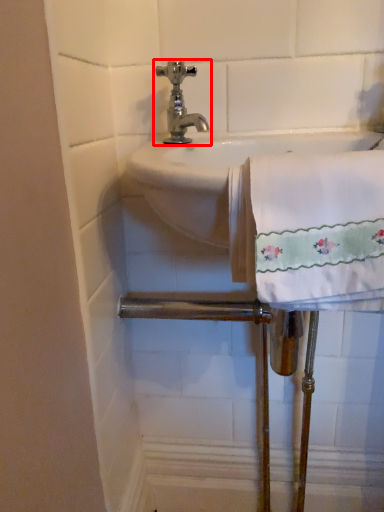
Question: Considering the relative positions of tap (annotated by the red box) and bath towel in the image provided, where is tap (annotated by the red box) located with respect to the staircase?

Choices:
 (A) left
 (B) right

Answer: (A)